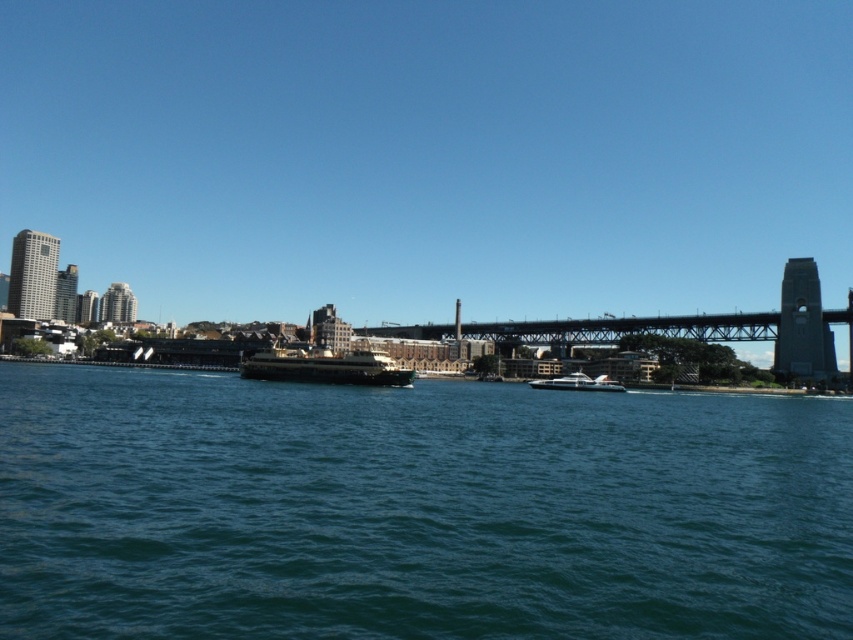
You are an observer standing on the dock looking out at the green water at center and the shiny black ferry at center. Which object appears taller from your perspective?

The shiny black ferry at center appears taller than the green water at center because the description states that the green water at center is not as tall as the shiny black ferry at center.

You are a drone operator tasked with capturing aerial footage of the dark gray metallic bridge at center and the shiny black ferry at center. The minimum safe distance for your drone to fly is 50 meters from any object. Can you safely fly your drone between these two objects without violating the safety distance?

The dark gray metallic bridge at center is 44.22 meters from the shiny black ferry at center. Since the minimum safe distance is 50 meters, the drone cannot fly between them without being too close to at least one of the objects.

You are a photographer planning to take a photo of the dark gray metallic bridge at center and the shiny black ferry at center from the shore. Based on their positions, which object should you frame first in your camera viewfinder to ensure both are captured in the shot?

The dark gray metallic bridge at center is positioned on the right side of the shiny black ferry at center, so you should frame the shiny black ferry at center first and then adjust to include the dark gray metallic bridge at center on its right side.